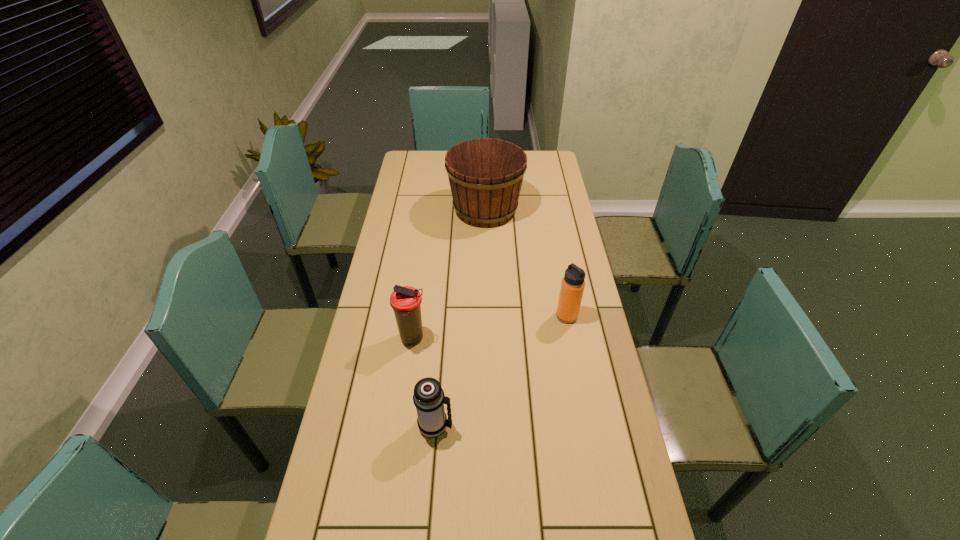
Where is `object that is at the left edge`? The image size is (960, 540). object that is at the left edge is located at coordinates (405, 301).

Locate an element on the screen. object present at the right edge is located at coordinates (572, 286).

In the image, there is a desktop. What are the coordinates of `free region at the far edge` in the screenshot? It's located at (444, 171).

Where is `free space at the left edge of the desktop`? This screenshot has width=960, height=540. free space at the left edge of the desktop is located at coordinates (x=402, y=181).

In the image, there is a desktop. Where is `vacant space at the right edge`? The height and width of the screenshot is (540, 960). vacant space at the right edge is located at coordinates (620, 486).

The image size is (960, 540). Find the location of `vacant space at the far left corner of the desktop`. vacant space at the far left corner of the desktop is located at coordinates (410, 158).

Locate an element on the screen. This screenshot has height=540, width=960. blank area at the far right corner is located at coordinates (549, 151).

The image size is (960, 540). Find the location of `vacant space that's between the wine bucket and the third farthest object`. vacant space that's between the wine bucket and the third farthest object is located at coordinates (449, 274).

Locate an element on the screen. empty space that is in between the rightmost thermos bottle and the nearest thermos bottle is located at coordinates (501, 370).

Locate an element on the screen. This screenshot has height=540, width=960. free spot between the shortest object and the farthest thermos bottle is located at coordinates (501, 370).